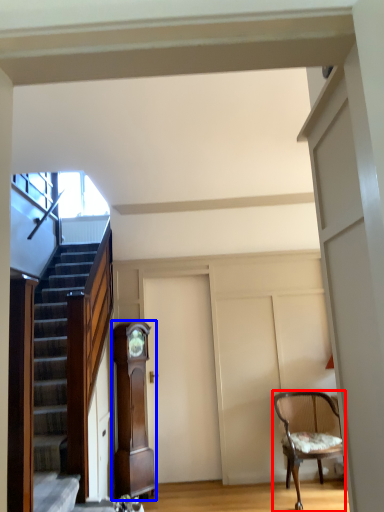
Question: Which of the following is the farthest to the observer, chair (highlighted by a red box) or cabinetry (highlighted by a blue box)?

Choices:
 (A) chair
 (B) cabinetry

Answer: (B)